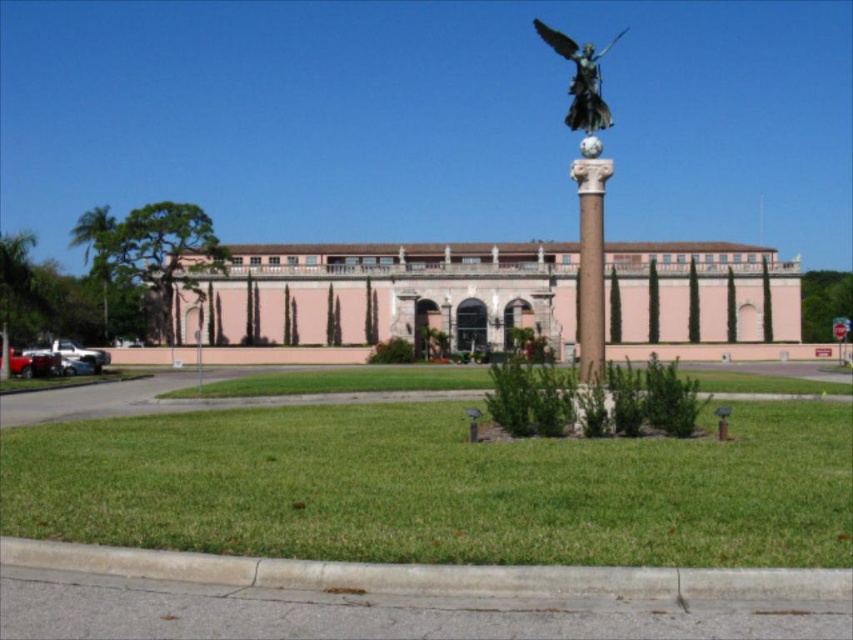
You are standing at the point marked as point (383, 294) in the image. What structure are you directly in front of?

You are directly in front of the pink stone building at center located at point (383, 294).

You are a visitor standing at the entrance of the building. You want to take a photo of both the white marble column at center and the bronze statue at center in the same frame. The camera you have can capture objects up to 30 meters apart. Will you be able to include both in your photo?

The white marble column at center is 30.58 meters from the bronze statue at center. Since the camera can only capture objects up to 30 meters apart, the distance between them is slightly too far, so both cannot be included in the same frame.

You are standing in front of the building and want to determine the relative positions of two points marked on the facade. Which point, point (x=595, y=296) or point (x=573, y=74), is closer to you?

Point (x=595, y=296) is closer to the viewer than point (x=573, y=74).